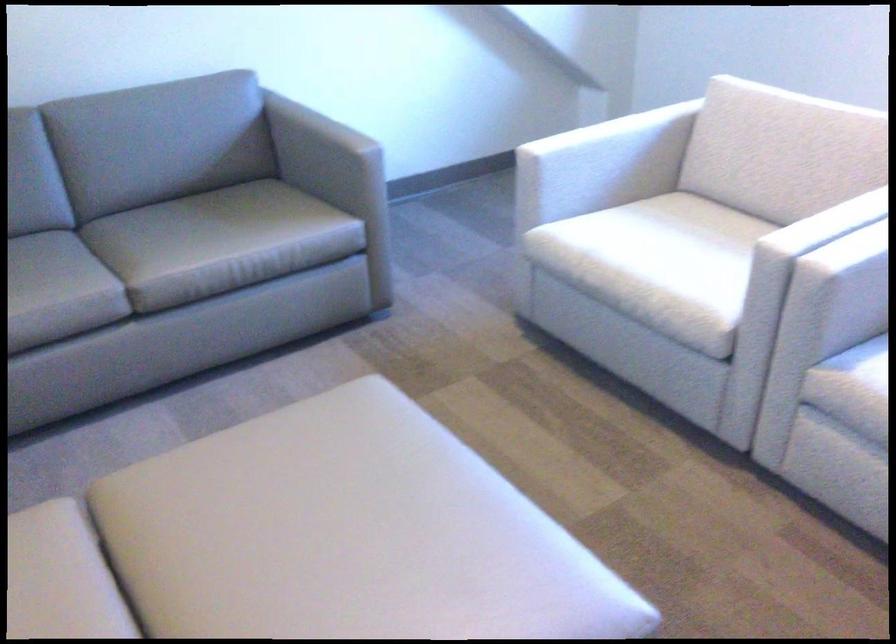
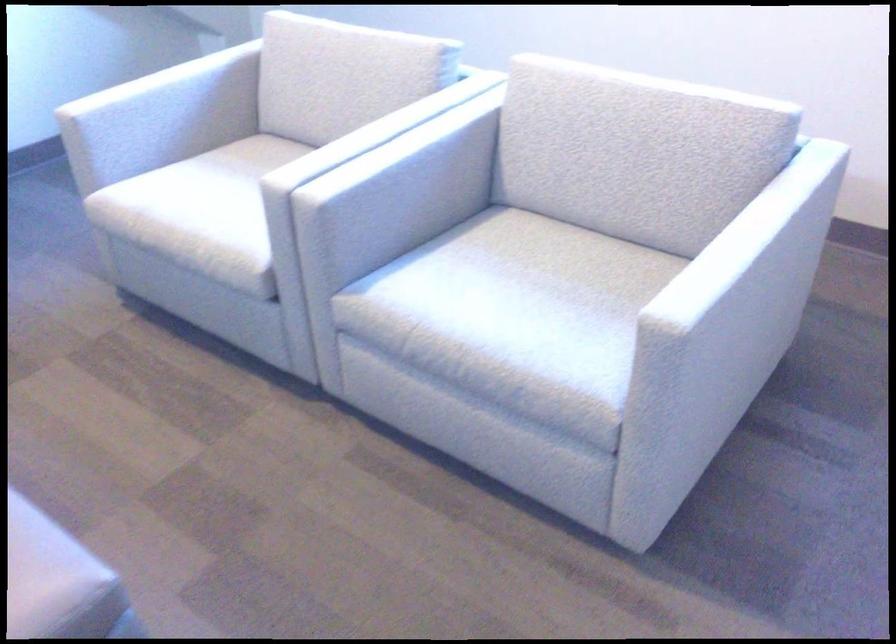
The point at (666, 247) is marked in the first image. Where is the corresponding point in the second image?

(220, 196)